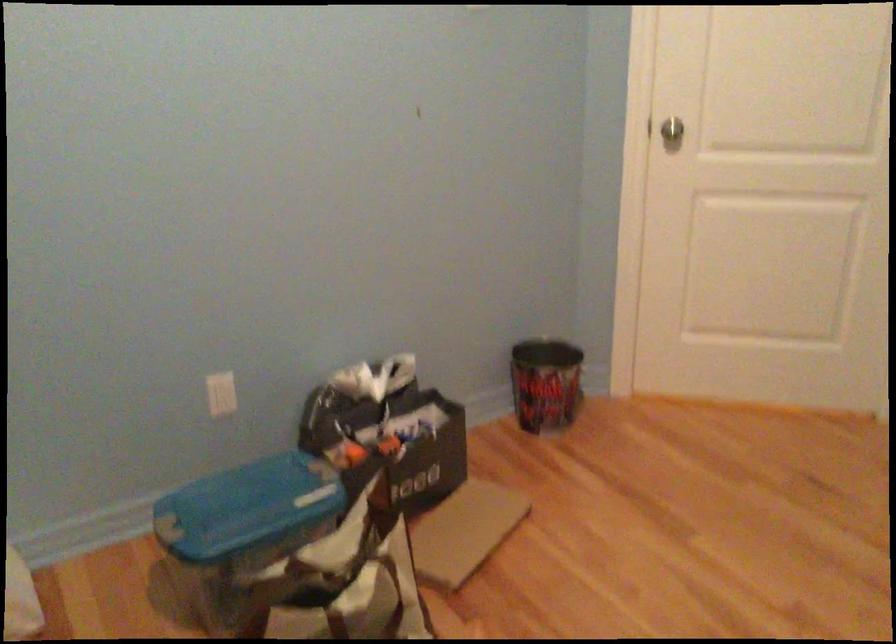
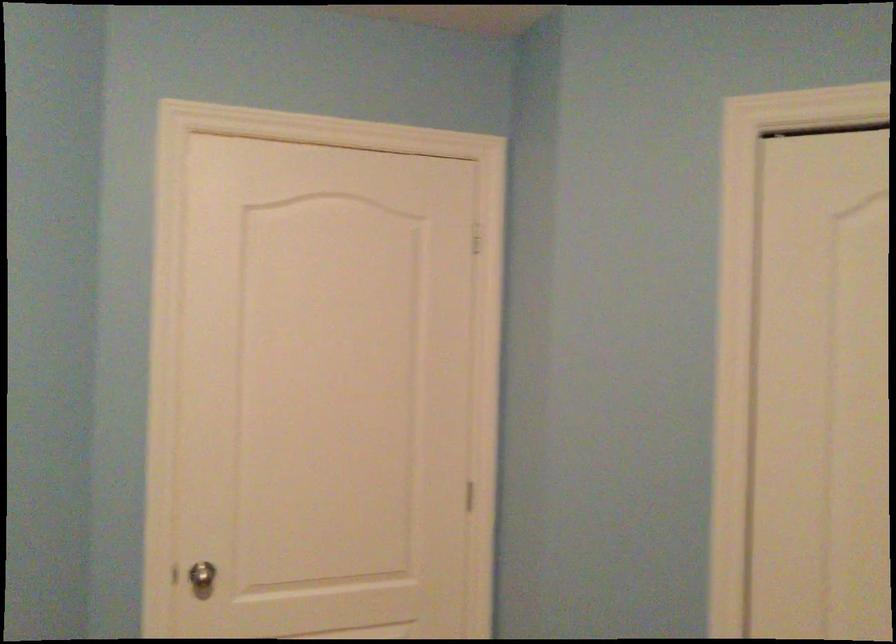
In the second image, find the point that corresponds to the point at 673,142 in the first image.

(202, 578)